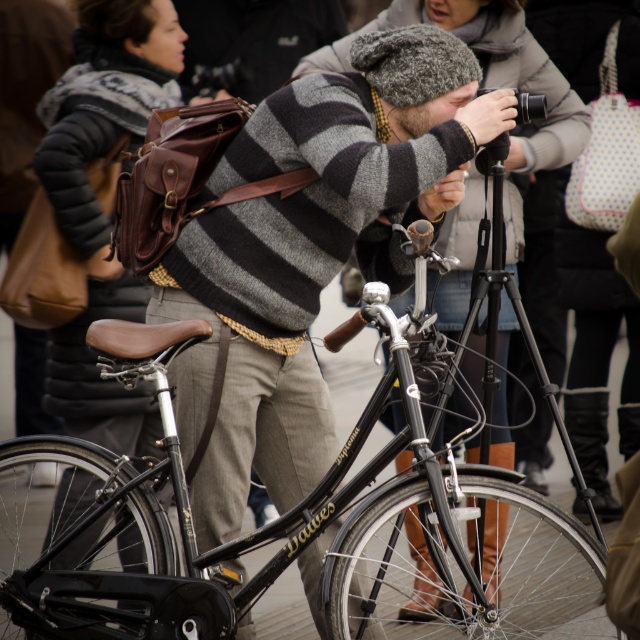
You are a photographer standing at the camera position. You want to take a closeup photo of the shiny black bicycle at center. The camera you are using has a minimum focusing distance of 10 meters. Can you take the photo without moving closer?

The shiny black bicycle at center is 11.22 meters away from camera. Since the minimum focusing distance is 10 meters, the camera can focus on the bicycle as it is beyond the minimum distance. Therefore, you can take the photo without moving closer.

You are a photographer standing at the tripod. You need to move to the gray striped sweater at center to adjust the lighting. The shiny black bicycle at center is in your way. Can you walk around it without stepping over it?

The distance between the shiny black bicycle at center and gray striped sweater at center is 12.87 feet. Since the bicycle is between you and the sweater, you can walk around it as long as there is enough space. However, the exact path isn

Please look at the image and locate the shiny black bicycle at center. What are the coordinates of its position?

The shiny black bicycle at center is located at coordinates point (280, 524).